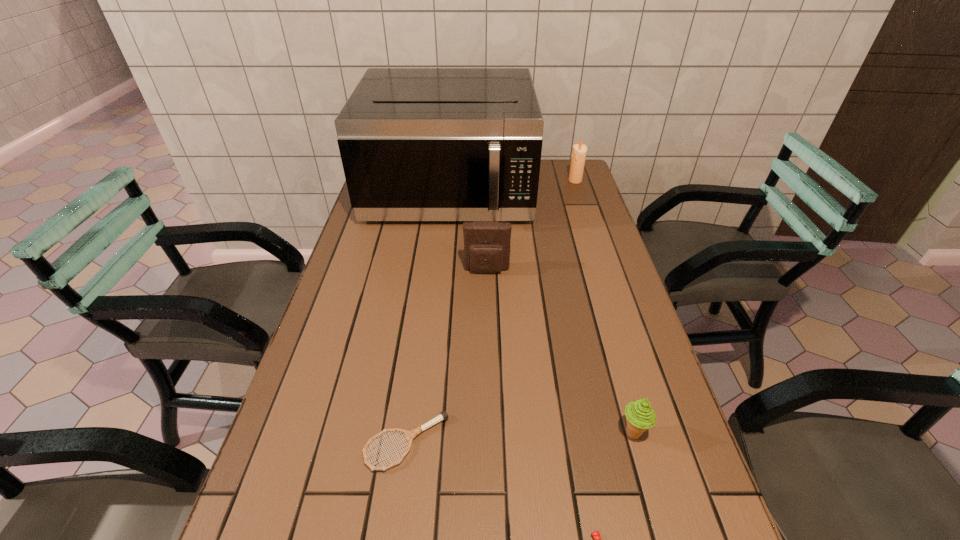
In order to click on free spot located on the back of the farther tennis racket in this screenshot , I will do `click(427, 289)`.

At what (x,y) coordinates should I click in order to perform the action: click on microwave_oven that is at the far edge. Please return your answer as a coordinate pair (x, y). Image resolution: width=960 pixels, height=540 pixels. Looking at the image, I should click on (417, 144).

The image size is (960, 540). I want to click on candle that is positioned at the far edge, so click(579, 151).

Locate an element on the screen. This screenshot has width=960, height=540. object at the left edge is located at coordinates (417, 144).

Where is `candle located in the right edge section of the desktop`? This screenshot has width=960, height=540. candle located in the right edge section of the desktop is located at coordinates (579, 151).

Identify the location of icecream that is at the right edge. Image resolution: width=960 pixels, height=540 pixels. (640, 416).

Find the location of `object that is at the far left corner`. object that is at the far left corner is located at coordinates (417, 144).

Identify the location of object present at the far right corner. (579, 151).

Image resolution: width=960 pixels, height=540 pixels. Find the location of `free spot at the left edge of the desktop`. free spot at the left edge of the desktop is located at coordinates (342, 337).

The image size is (960, 540). What are the coordinates of `free region at the right edge of the desktop` in the screenshot? It's located at (x=630, y=382).